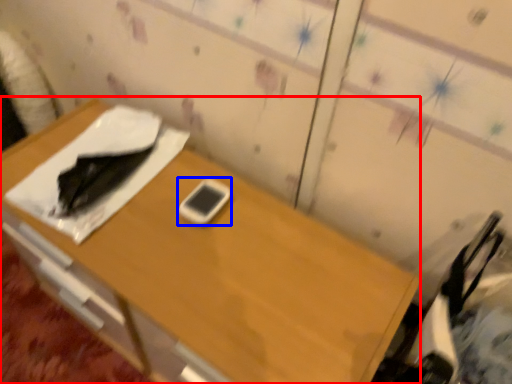
Question: Which object appears farthest to the camera in this image, desk (highlighted by a red box) or mobile phone (highlighted by a blue box)?

Choices:
 (A) desk
 (B) mobile phone

Answer: (B)